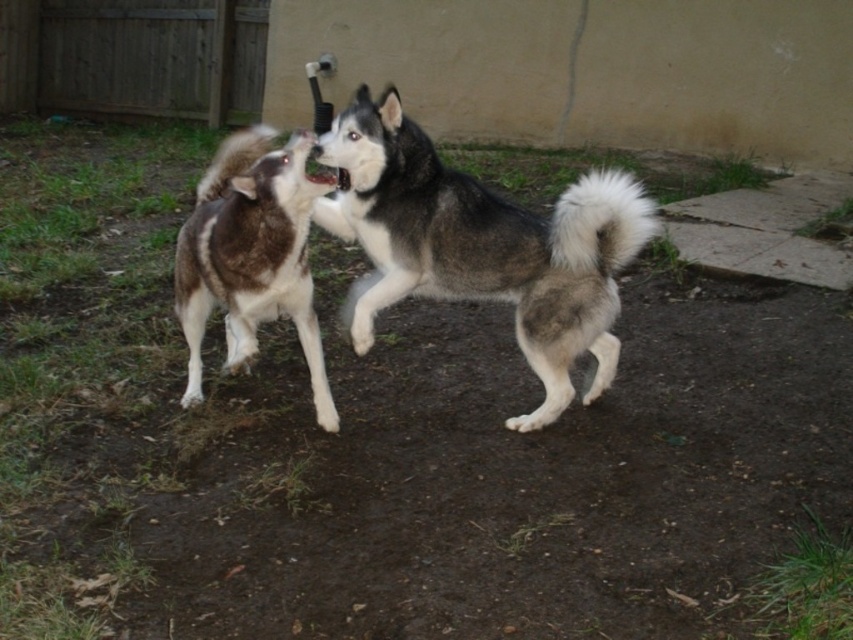
Based on the scene description, where is the gray and white fur dog at center located in terms of coordinates?

The gray and white fur dog at center is located at coordinates [480,244].

You are a dog trainer observing two huskies in a backyard. You see the gray and white fur dog at center and the brown fur dog at left. Which dog would you expect to have a larger size based on their positions and the scene?

The gray and white fur dog at center is bigger than the brown fur dog at left, so the gray and white fur dog at center would be the larger one.

You are a dog trainer observing two huskies in a backyard. You see the gray and white fur dog at center and the brown fur dog at left. Which dog is more to the right side?

The gray and white fur dog at center is more to the right side than the brown fur dog at left.